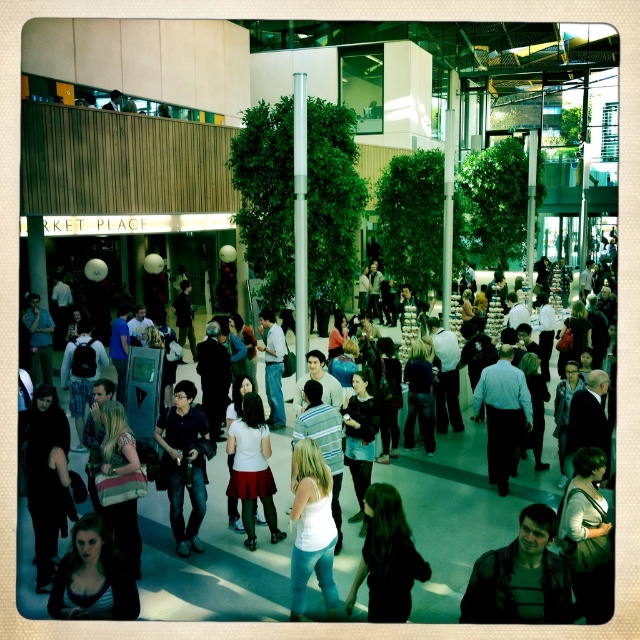
You are a photographer standing at the camera position in the scene. You want to capture a closeup shot of the matte black jacket at lower right without moving closer. Can you estimate if the jacket is within the typical focus range of a standard camera lens?

The matte black jacket at lower right is 17.46 feet away from camera. A standard camera lens typically has a focus range starting around 3 feet and extending to infinity, so the jacket at 17.46 feet is well within the focus range and can be captured clearly without moving closer.

You are a photographer standing at the entrance of the space. You want to capture both the black fabric dress at center and the light blue shirt at center in a single photo without moving your position. Given that your camera has a maximum horizontal field of view of 5 meters, will you be able to include both subjects in the frame?

The black fabric dress at center and the light blue shirt at center are 4.66 meters apart from each other. Since the distance between them is less than the camera maximum horizontal field of view of 5 meters, you can capture both in a single photo without moving your position.